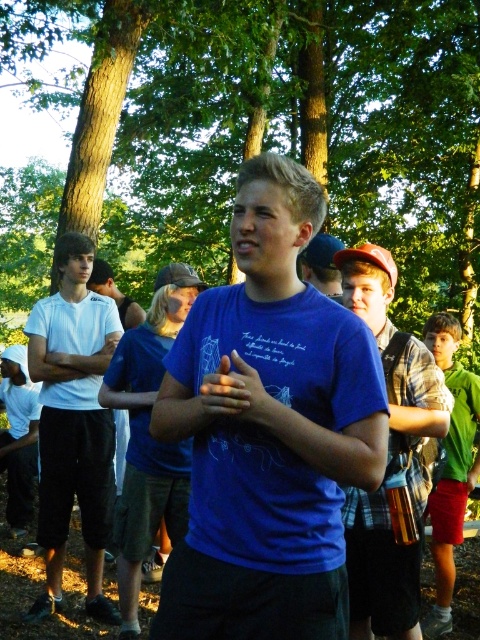
You are standing in the park and see two points in the scene. The first point is at coordinate point [430,99] and the second is at point [155,307]. Which point is closer to you?

Point [430,99] is further to the camera than point [155,307], so the point closer to you is point [155,307].